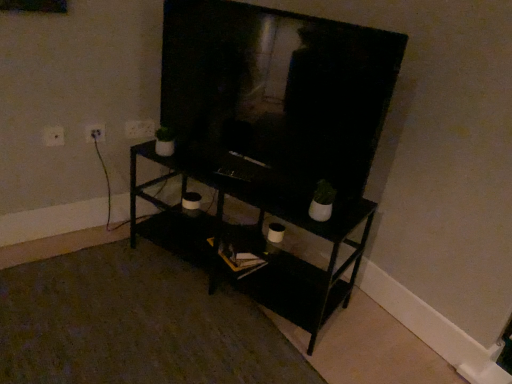
Question: Is white plastic electric outlet at upper left, the 1th electric outlet from the right, not near white plastic electric outlet at upper left, the 2th electric outlet when ordered from right to left?

Choices:
 (A) no
 (B) yes

Answer: (A)

Question: From the image's perspective, does white plastic electric outlet at upper left, which is counted as the first electric outlet, starting from the back, appear lower than white plastic electric outlet at upper left, the 2th electric outlet when ordered from right to left?

Choices:
 (A) yes
 (B) no

Answer: (B)

Question: From a real-world perspective, is white plastic electric outlet at upper left, the third electric outlet when ordered from front to back, positioned over white plastic electric outlet at upper left, the 2th electric outlet when ordered from right to left, based on gravity?

Choices:
 (A) no
 (B) yes

Answer: (B)

Question: From the image's perspective, would you say white plastic electric outlet at upper left, the third electric outlet positioned from the left, is positioned over white plastic electric outlet at upper left, the 2th electric outlet when ordered from right to left?

Choices:
 (A) no
 (B) yes

Answer: (B)

Question: Can white plastic electric outlet at upper left, the second electric outlet positioned from the left, be found inside white plastic electric outlet at upper left, the 1th electric outlet from the right?

Choices:
 (A) no
 (B) yes

Answer: (A)

Question: Considering the positions of point (90, 125) and point (200, 223), is point (90, 125) closer or farther from the camera than point (200, 223)?

Choices:
 (A) farther
 (B) closer

Answer: (A)

Question: Would you say white plastic electric outlet at upper left, acting as the 2th electric outlet starting from the front, is to the left or to the right of black matte shelf at center in the picture?

Choices:
 (A) left
 (B) right

Answer: (A)

Question: Relative to black matte shelf at center, is white plastic electric outlet at upper left, acting as the 2th electric outlet starting from the front, in front or behind?

Choices:
 (A) behind
 (B) front

Answer: (A)

Question: From the image's perspective, is white plastic electric outlet at upper left, the second electric outlet positioned from the left, above or below black matte shelf at center?

Choices:
 (A) above
 (B) below

Answer: (A)

Question: Is point (61, 132) positioned closer to the camera than point (141, 129)?

Choices:
 (A) farther
 (B) closer

Answer: (B)

Question: From the image's perspective, relative to white plastic electric outlet at upper left, the third electric outlet when ordered from front to back, is white plastic electric outlet at upper left, the 3th electric outlet when ordered from back to front, above or below?

Choices:
 (A) below
 (B) above

Answer: (A)

Question: Looking at their shapes, would you say white plastic electric outlet at upper left, the 3th electric outlet when ordered from back to front, is wider or thinner than white plastic electric outlet at upper left, the third electric outlet when ordered from front to back?

Choices:
 (A) thin
 (B) wide

Answer: (B)

Question: Which is correct: white plastic electric outlet at upper left, the 3th electric outlet when ordered from back to front, is inside white plastic electric outlet at upper left, the third electric outlet positioned from the left, or outside of it?

Choices:
 (A) outside
 (B) inside

Answer: (A)

Question: From a real-world perspective, is black matte shelf at center positioned above or below white plastic electric outlet at upper left, which ranks as the first electric outlet in front-to-back order?

Choices:
 (A) above
 (B) below

Answer: (B)

Question: Looking at their shapes, would you say black matte shelf at center is wider or thinner than white plastic electric outlet at upper left, the 3th electric outlet when ordered from back to front?

Choices:
 (A) wide
 (B) thin

Answer: (A)